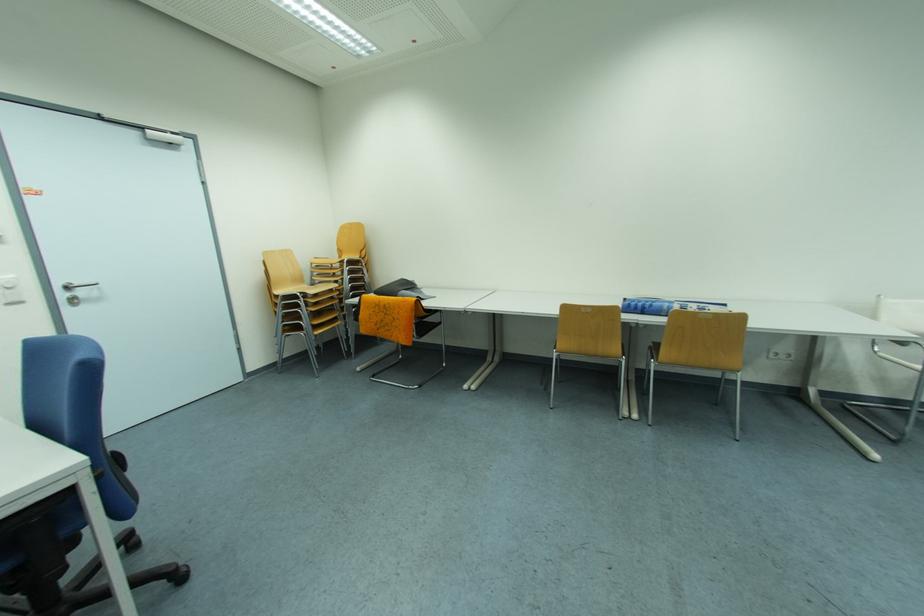
What do you see at coordinates (78, 285) in the screenshot? I see `the metal door handle` at bounding box center [78, 285].